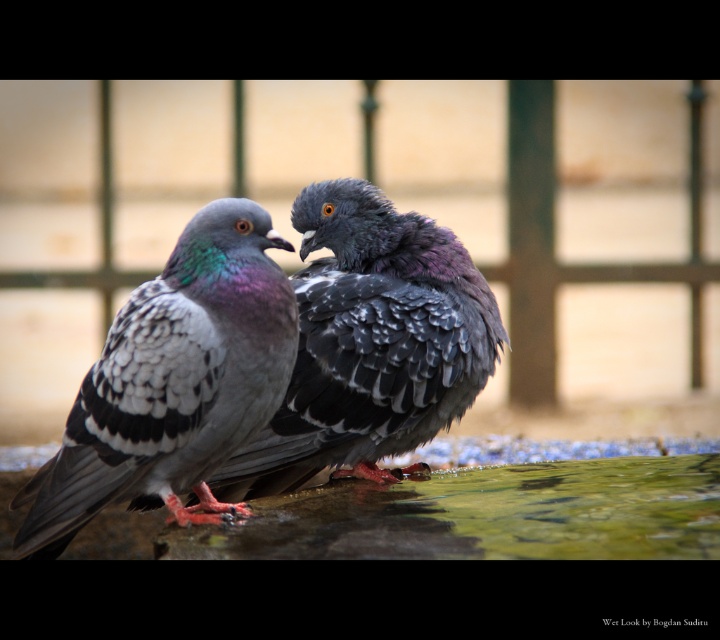
Question: Is speckled feathered pigeon at left wider than shiny gray feathers at center?

Choices:
 (A) yes
 (B) no

Answer: (B)

Question: Which point is closer to the camera?

Choices:
 (A) (217, 492)
 (B) (284, 378)

Answer: (B)

Question: Observing the image, what is the correct spatial positioning of speckled feathered pigeon at left in reference to shiny gray feathers at center?

Choices:
 (A) above
 (B) below

Answer: (B)

Question: From the image, what is the correct spatial relationship of speckled feathered pigeon at left in relation to shiny gray feathers at center?

Choices:
 (A) right
 (B) left

Answer: (B)